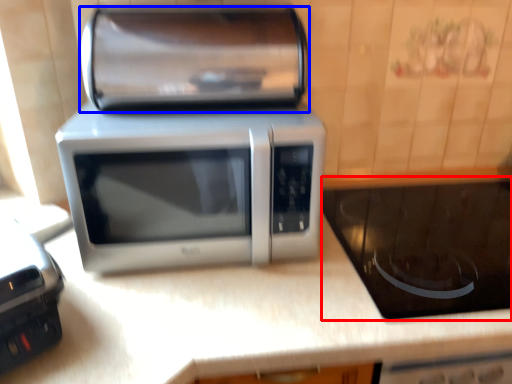
Question: Among these objects, which one is farthest to the camera, appliance (highlighted by a red box) or stereo (highlighted by a blue box)?

Choices:
 (A) appliance
 (B) stereo

Answer: (A)